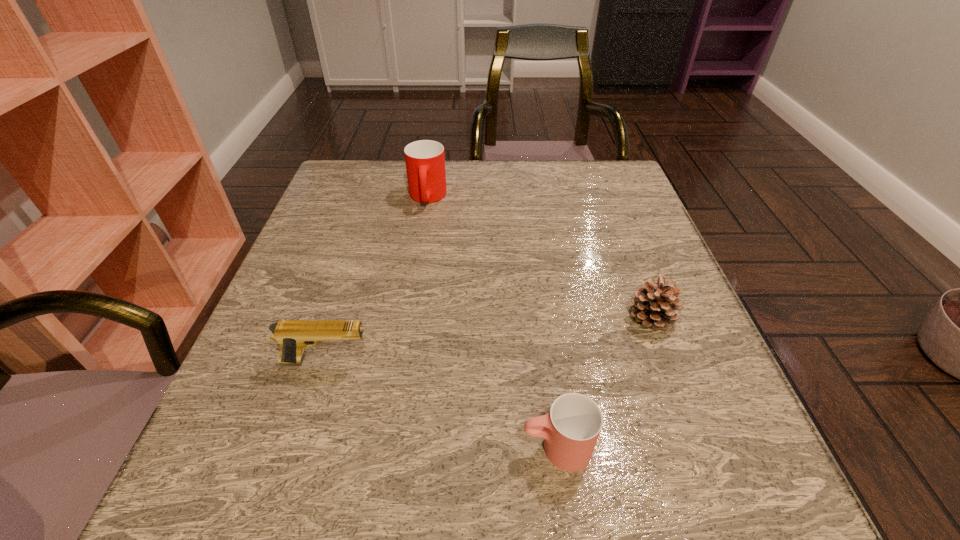
Locate an element on the screen. free space that satisfies the following two spatial constraints: 1. at the barrel of the leftmost object; 2. on the side of the right cup with the handle is located at coordinates (300, 448).

This screenshot has width=960, height=540. I want to click on vacant space that satisfies the following two spatial constraints: 1. on the side of the third nearest object with the handle; 2. on the left side of the nearest object, so [x=540, y=317].

At what (x,y) coordinates should I click in order to perform the action: click on vacant area in the image that satisfies the following two spatial constraints: 1. on the side of the farther cup with the handle; 2. at the barrel of the pistol. Please return your answer as a coordinate pair (x, y). Image resolution: width=960 pixels, height=540 pixels. Looking at the image, I should click on (401, 361).

Where is `free space that satisfies the following two spatial constraints: 1. at the barrel of the pistol; 2. on the side of the second object from right to left with the handle`? The height and width of the screenshot is (540, 960). free space that satisfies the following two spatial constraints: 1. at the barrel of the pistol; 2. on the side of the second object from right to left with the handle is located at coordinates (300, 448).

In order to click on vacant point that satisfies the following two spatial constraints: 1. on the side of the shorter cup with the handle; 2. on the left side of the pinecone in this screenshot , I will do `click(540, 317)`.

Identify the location of vacant space that satisfies the following two spatial constraints: 1. on the side of the right cup with the handle; 2. on the side of the third object from right to left with the handle. (524, 198).